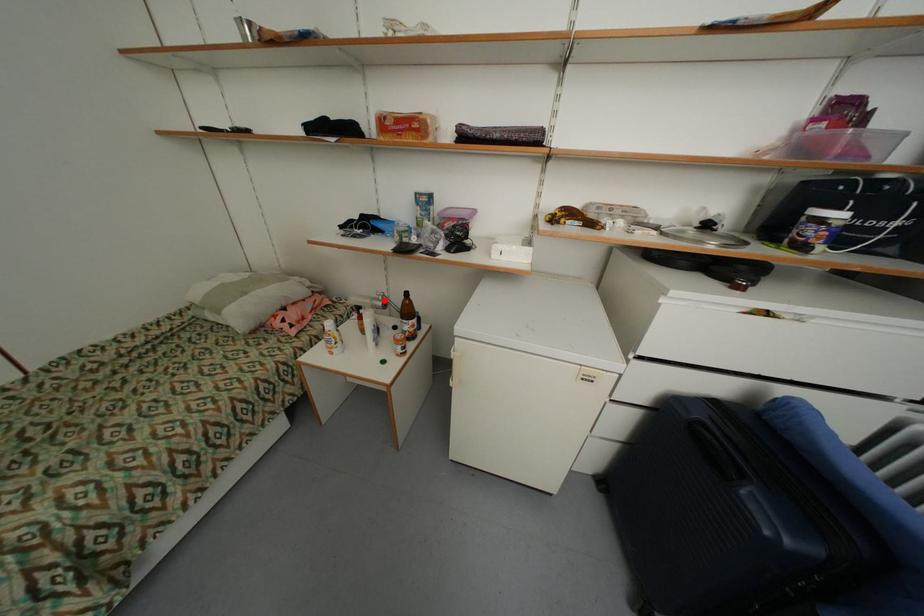
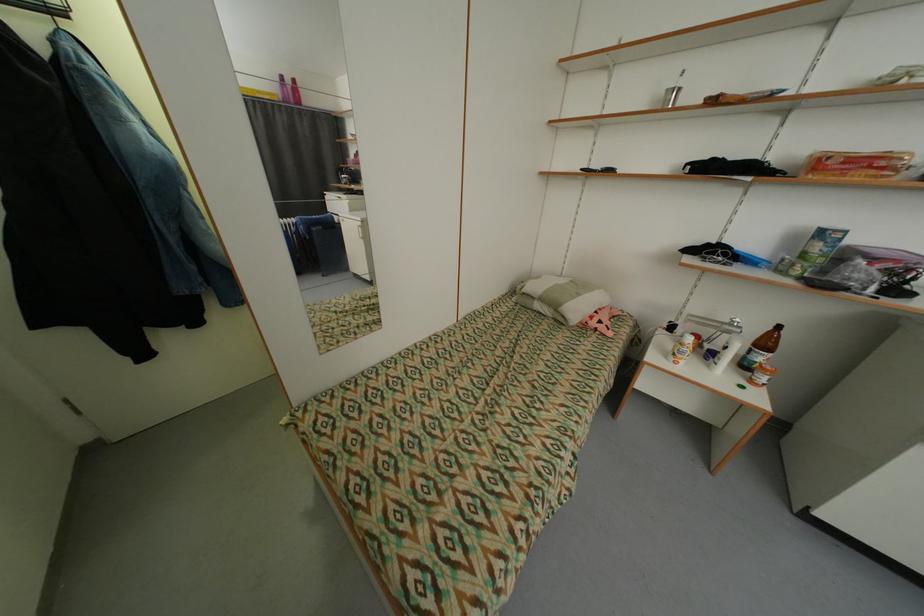
Question: I am providing you with two images of the same scene from different viewpoints. A red point is marked on the first image. At the location where the point appears in image 1, is it still visible in image 2?

Choices:
 (A) Yes
 (B) No

Answer: (A)